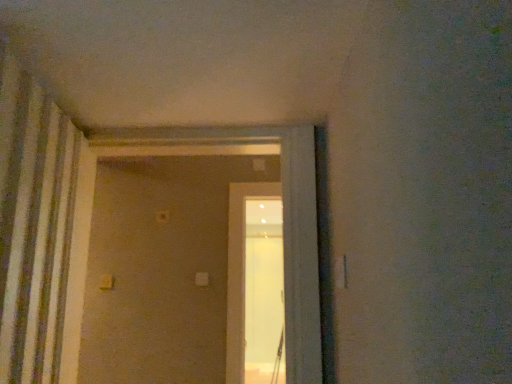
What is the approximate height of white striped curtain at left?

It is 79.90 centimeters.

What do you see at coordinates (33, 225) in the screenshot? The image size is (512, 384). I see `white striped curtain at left` at bounding box center [33, 225].

Identify the location of white striped curtain at left. (33, 225).

Identify the location of white striped curtain at left. The height and width of the screenshot is (384, 512). (33, 225).